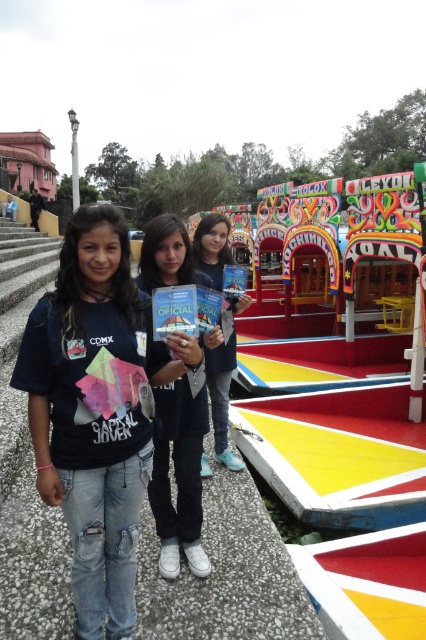
Question: Does matte black jacket at center appear under matte blue jeans at center?

Choices:
 (A) yes
 (B) no

Answer: (A)

Question: Which point is closer to the camera taking this photo?

Choices:
 (A) (230, 454)
 (B) (126, 468)

Answer: (B)

Question: Which object is closer to the camera taking this photo?

Choices:
 (A) denim jeans at center
 (B) matte blue jeans at center
 (C) matte black jacket at center

Answer: (A)

Question: Can you confirm if matte black jacket at center is wider than matte blue jeans at center?

Choices:
 (A) yes
 (B) no

Answer: (A)

Question: Does denim jeans at center appear under matte blue jeans at center?

Choices:
 (A) yes
 (B) no

Answer: (A)

Question: Which point is farther to the camera?

Choices:
 (A) matte black jacket at center
 (B) matte blue jeans at center

Answer: (B)